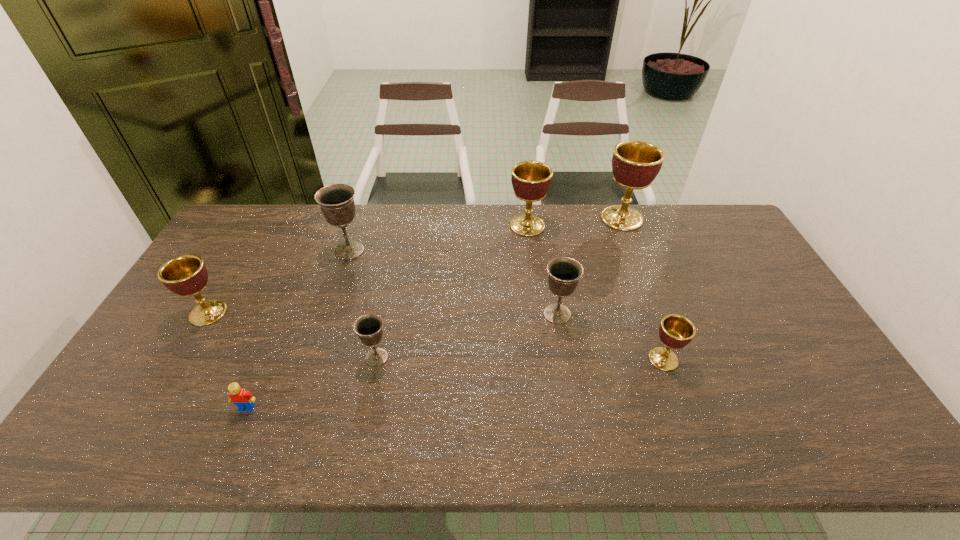
You are a GUI agent. You are given a task and a screenshot of the screen. Output one action in this format:
    pyautogui.click(x=<x>, y=<y>)
    Task: Click on the chalice object that ranks as the third closest to the nearest golden chalice
    
    Given the screenshot: What is the action you would take?
    pyautogui.click(x=531, y=180)

Image resolution: width=960 pixels, height=540 pixels. What are the coordinates of `golden chalice that is the second closest to the second golden chalice from left to right` in the screenshot? It's located at 675,332.

Identify which golden chalice is located as the third nearest to the second farthest bronze chalice. Please provide its 2D coordinates. Your answer should be formatted as a tuple, i.e. [(x, y)], where the tuple contains the x and y coordinates of a point satisfying the conditions above.

[(635, 164)]

Identify the location of the closest bronze chalice to the smallest golden chalice. (564, 272).

I want to click on bronze chalice that is the third closest one to the nearest golden chalice, so click(337, 204).